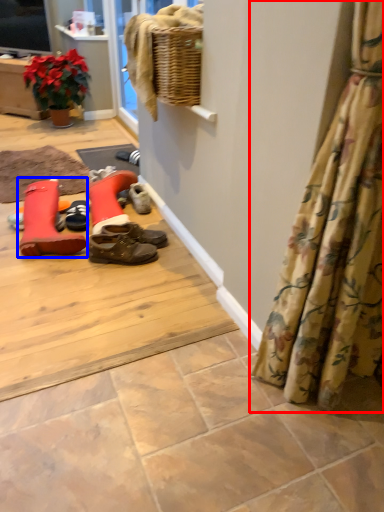
Question: Which object is further to the camera taking this photo, curtain (highlighted by a red box) or footwear (highlighted by a blue box)?

Choices:
 (A) curtain
 (B) footwear

Answer: (B)